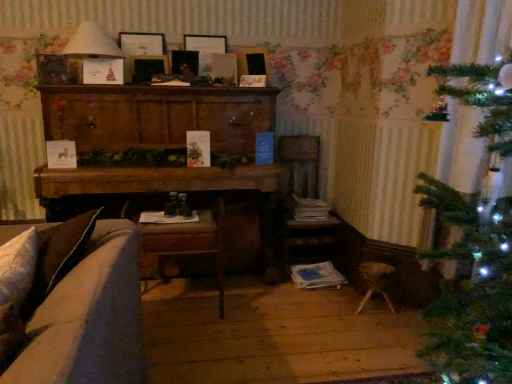
Where is `vacant region to the right of woodenchair at lower center`? Image resolution: width=512 pixels, height=384 pixels. vacant region to the right of woodenchair at lower center is located at coordinates (247, 315).